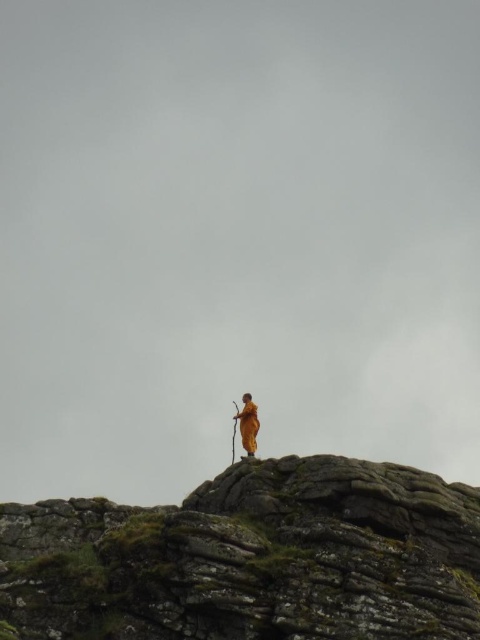
You are a hiker who has just reached the summit. You notice the mossy rock at center and the golden fabric statue at center. Which object is positioned higher in elevation?

The golden fabric statue at center is positioned higher in elevation than the mossy rock at center because the mossy rock at center is located below it.